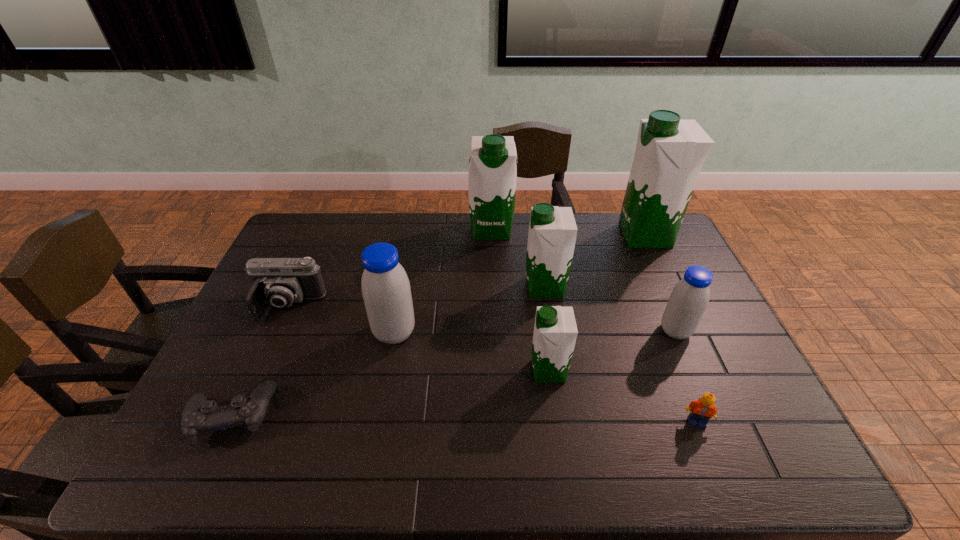
Find the location of a particular element. the smaller blue soya milk is located at coordinates (688, 301).

Find the location of a particular element. This screenshot has height=540, width=960. camera is located at coordinates (279, 282).

Image resolution: width=960 pixels, height=540 pixels. In order to click on Lego in this screenshot , I will do tap(703, 409).

Where is `orange Lego`? This screenshot has height=540, width=960. orange Lego is located at coordinates (703, 409).

The image size is (960, 540). Identify the location of control. (199, 416).

Where is `gray control`? The width and height of the screenshot is (960, 540). gray control is located at coordinates (199, 416).

Identify the location of vacant point located on the front-facing side of the rightmost green soya milk. The image size is (960, 540). (590, 235).

Where is `free space located 0.310m on the front-facing side of the rightmost green soya milk`? free space located 0.310m on the front-facing side of the rightmost green soya milk is located at coordinates (534, 235).

Image resolution: width=960 pixels, height=540 pixels. I want to click on vacant area situated 0.380m on the front-facing side of the rightmost green soya milk, so click(515, 235).

Identify the location of vacant space located 0.070m on the front-facing side of the leftmost green soya milk. The image size is (960, 540). pos(492,255).